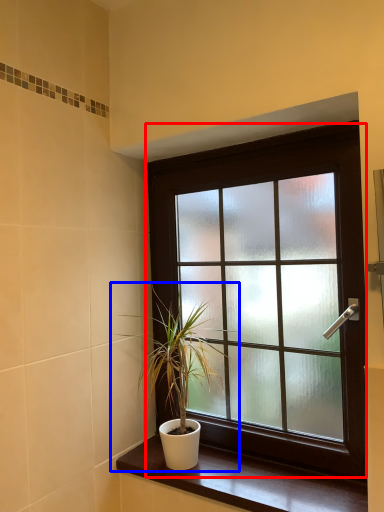
Question: Which object is closer to the camera taking this photo, window (highlighted by a red box) or houseplant (highlighted by a blue box)?

Choices:
 (A) window
 (B) houseplant

Answer: (A)